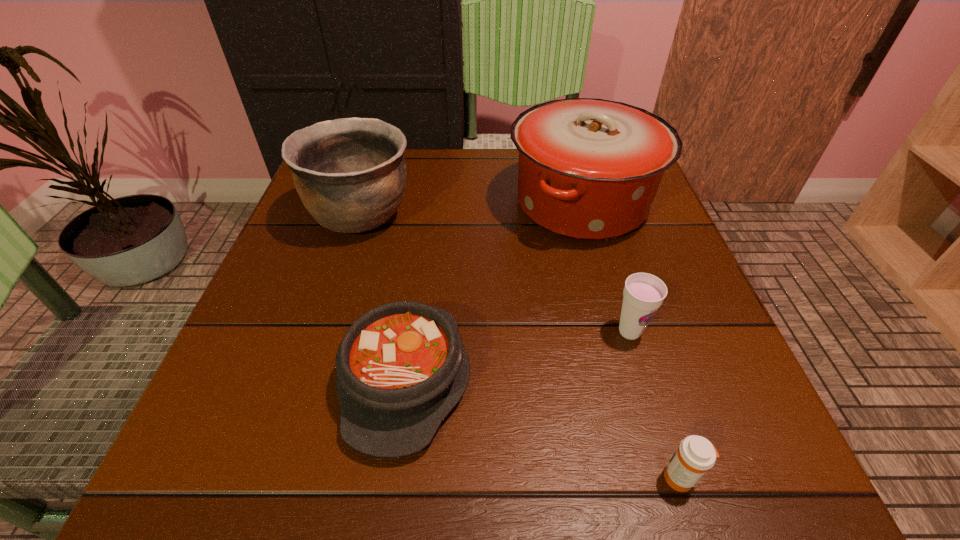
You are a GUI agent. You are given a task and a screenshot of the screen. Output one action in this format:
    pyautogui.click(x=<x>, y=<y>)
    Task: Click on the object at the far left corner
    The width and height of the screenshot is (960, 540).
    Given the screenshot: What is the action you would take?
    pyautogui.click(x=350, y=173)

Locate an element on the screen. The width and height of the screenshot is (960, 540). object that is positioned at the far right corner is located at coordinates 589,169.

I want to click on object at the near right corner, so click(x=695, y=455).

Where is `free space at the far edge of the desktop`? Image resolution: width=960 pixels, height=540 pixels. free space at the far edge of the desktop is located at coordinates (434, 148).

Find the location of a particular element. The width and height of the screenshot is (960, 540). free space at the near edge of the desktop is located at coordinates (636, 489).

Identify the location of blank space at the left edge of the desktop. This screenshot has height=540, width=960. (320, 260).

In the image, there is a desktop. At what (x,y) coordinates should I click in order to perform the action: click on vacant space at the right edge. Please return your answer as a coordinate pair (x, y). Image resolution: width=960 pixels, height=540 pixels. Looking at the image, I should click on (668, 286).

In the image, there is a desktop. Identify the location of vacant space at the near left corner. Image resolution: width=960 pixels, height=540 pixels. (240, 487).

The image size is (960, 540). Identify the location of free spot at the near right corner of the desktop. (744, 461).

Image resolution: width=960 pixels, height=540 pixels. What are the coordinates of `vacant space that's between the shorter casserole and the tallest object` in the screenshot? It's located at (493, 291).